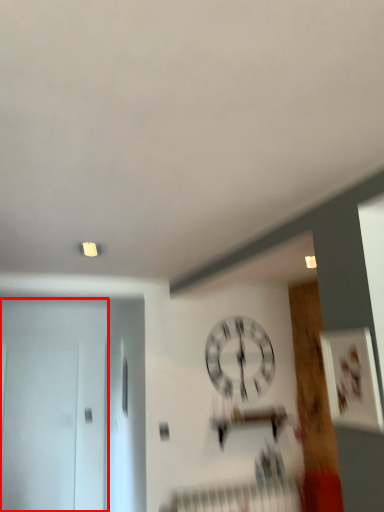
Question: Where is door (annotated by the red box) located in relation to wall clock in the image?

Choices:
 (A) left
 (B) right

Answer: (A)